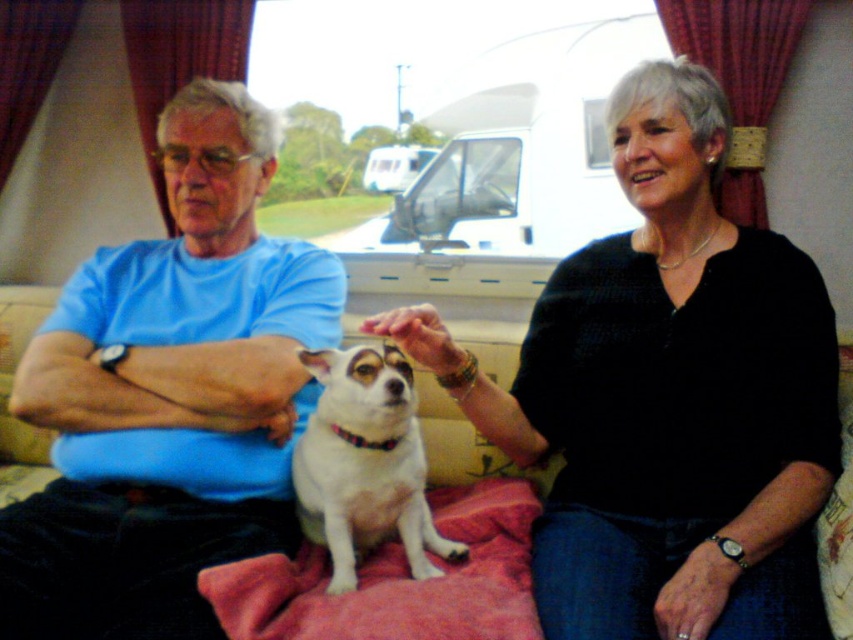
Between white fur dog at center and white plastic recreational vehicle at center, which one appears on the right side from the viewer's perspective?

white plastic recreational vehicle at center is more to the right.

Does white fur dog at center have a lesser height compared to white plastic recreational vehicle at center?

Incorrect, white fur dog at center's height does not fall short of white plastic recreational vehicle at center's.

Is point (352, 586) farther from viewer compared to point (393, 152)?

That is False.

Where is `white fur dog at center`? white fur dog at center is located at coordinates (364, 464).

Is blue t-shirt at left positioned at the back of white plastic recreational vehicle at center?

No, it is not.

Is blue t-shirt at left smaller than white plastic recreational vehicle at center?

Incorrect, blue t-shirt at left is not smaller in size than white plastic recreational vehicle at center.

Is point (154, 435) positioned after point (392, 166)?

No, it is in front of (392, 166).

At what (x,y) coordinates should I click in order to perform the action: click on blue t-shirt at left. Please return your answer as a coordinate pair (x, y). Image resolution: width=853 pixels, height=640 pixels. Looking at the image, I should click on (169, 396).

Which of these two, black knitted sweater at upper right or white fur dog at center, stands taller?

black knitted sweater at upper right is taller.

Is point (621, 561) more distant than point (363, 500)?

No, (621, 561) is in front of (363, 500).

Is point (817, 408) positioned in front of point (428, 536)?

Yes, point (817, 408) is closer to viewer.

I want to click on black knitted sweater at upper right, so click(666, 397).